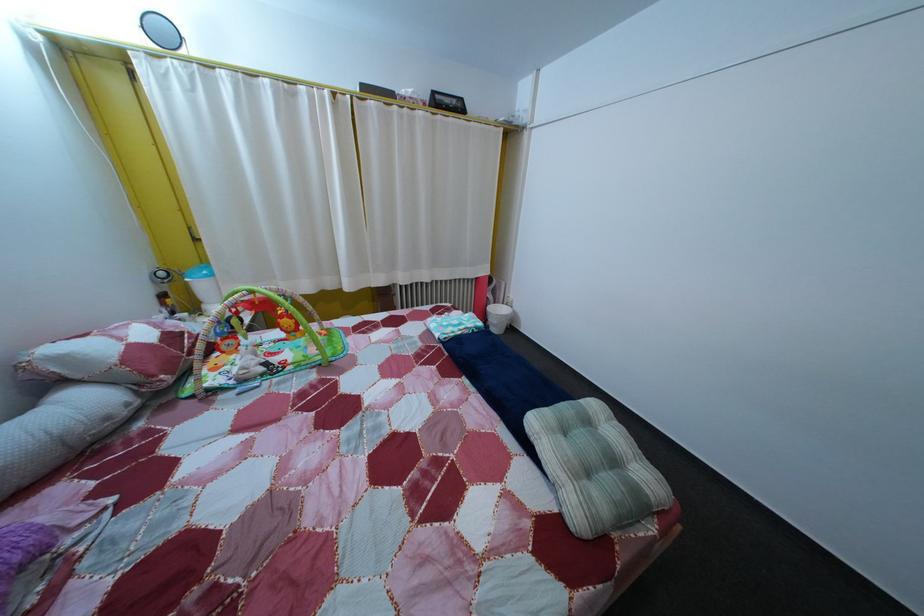
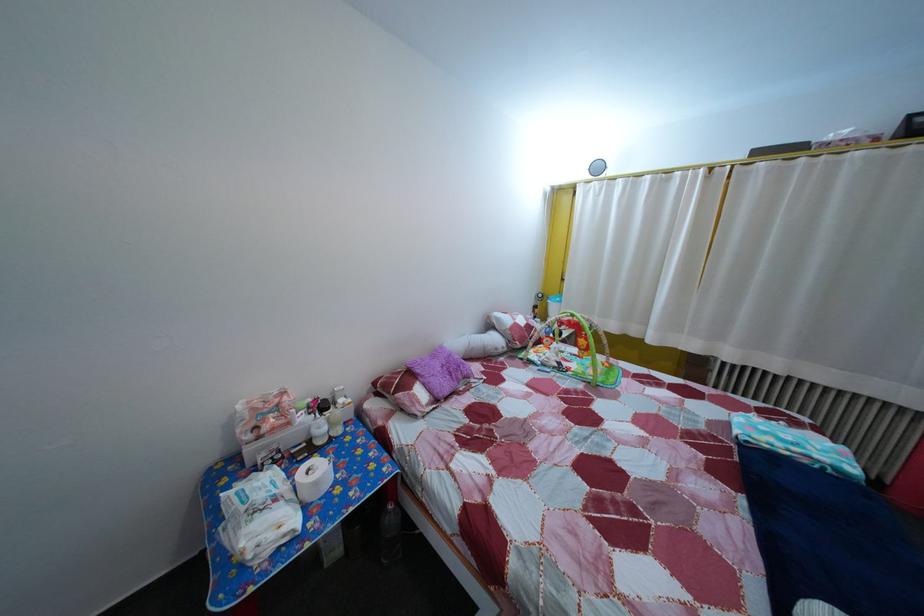
The point at (275,89) is marked in the first image. Where is the corresponding point in the second image?

(659, 185)